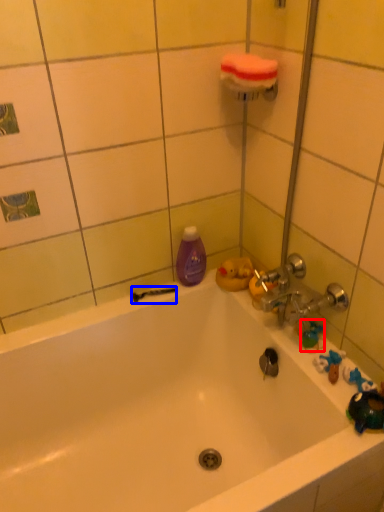
Question: Which object is closer to the camera taking this photo, toy (highlighted by a red box) or shower (highlighted by a blue box)?

Choices:
 (A) toy
 (B) shower

Answer: (A)